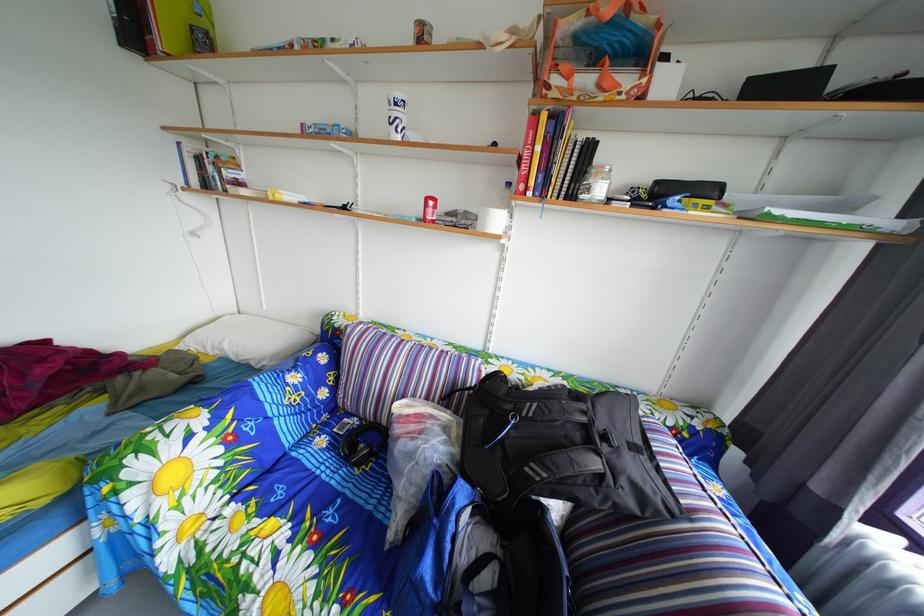
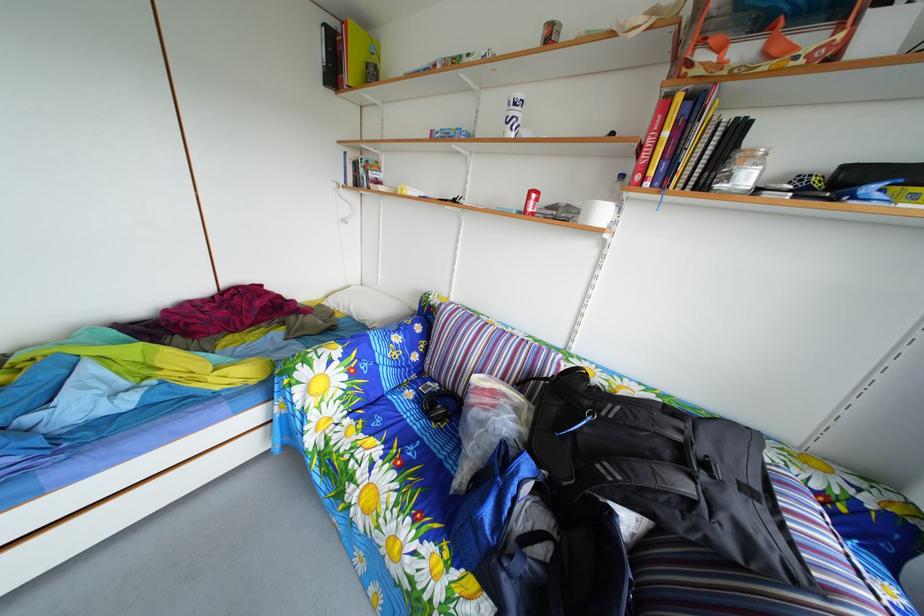
Question: How did the camera likely rotate?

Choices:
 (A) Left
 (B) Right
 (C) Up
 (D) Down

Answer: (A)